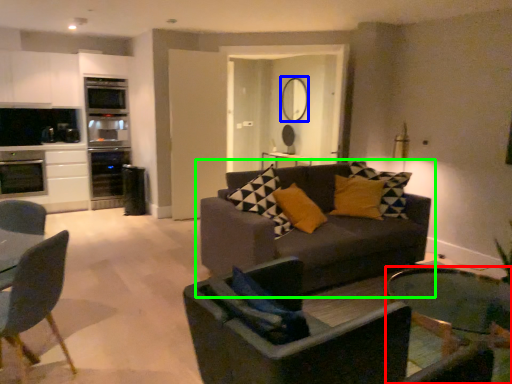
Question: Estimate the real-world distances between objects in this image. Which object is farther from coffee table (highlighted by a red box), mirror (highlighted by a blue box) or studio couch (highlighted by a green box)?

Choices:
 (A) mirror
 (B) studio couch

Answer: (A)